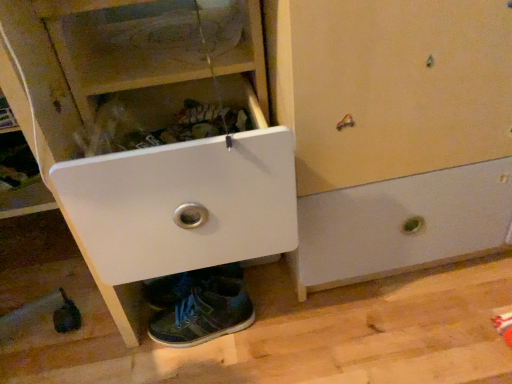
Where is `free space in front of green suede shoes at lower center`? This screenshot has height=384, width=512. free space in front of green suede shoes at lower center is located at coordinates (205, 363).